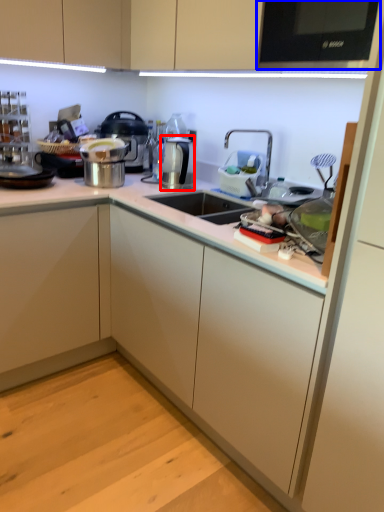
Question: Which object appears closest to the camera in this image, appliance (highlighted by a red box) or home appliance (highlighted by a blue box)?

Choices:
 (A) appliance
 (B) home appliance

Answer: (B)